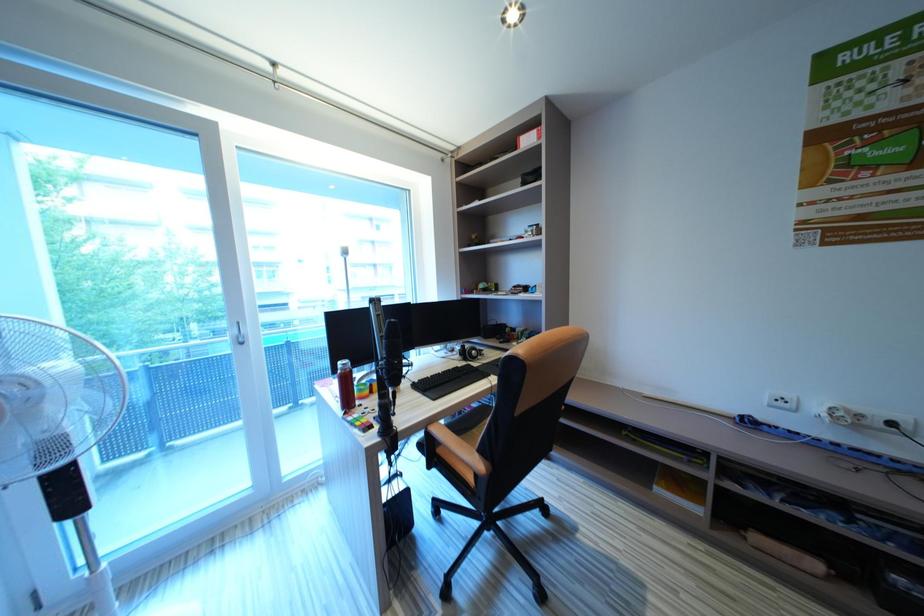
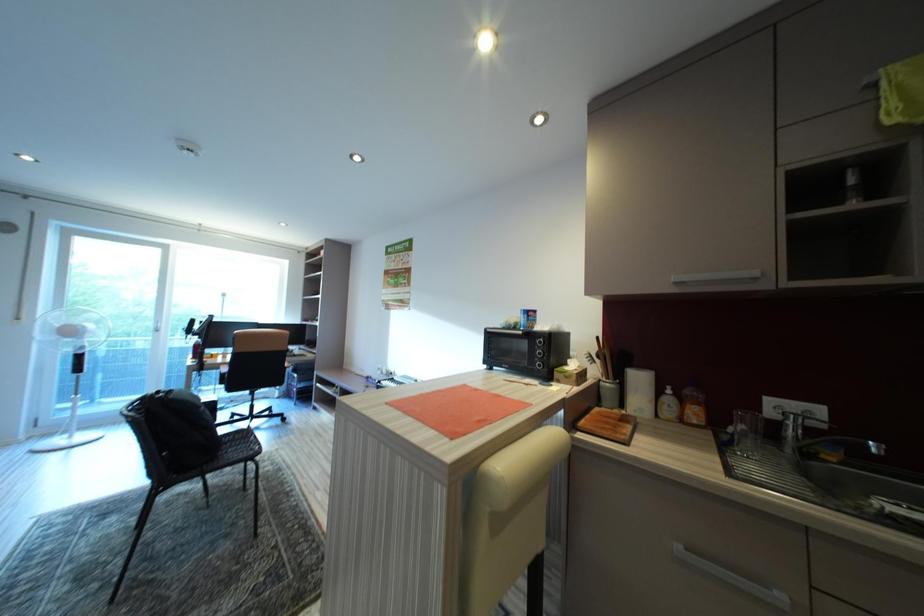
In a continuous first-person perspective shot, in which direction is the camera moving?

The cameraman walked toward right, backward.